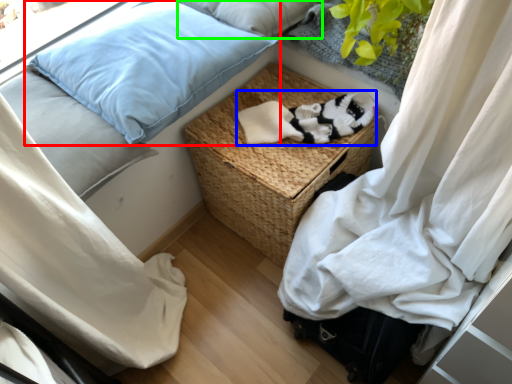
Question: Estimate the real-world distances between objects in this image. Which object is farther from pillow (highlighted by a red box), clothing (highlighted by a blue box) or pillow (highlighted by a green box)?

Choices:
 (A) clothing
 (B) pillow

Answer: (A)